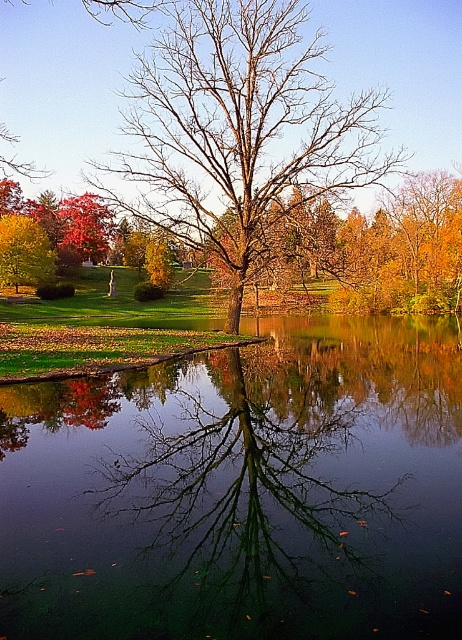
Question: Which point is farther to the camera?

Choices:
 (A) green reflective water at center
 (B) yellow-green leaves at left
 (C) bare wood tree at center

Answer: (B)

Question: Among these points, which one is nearest to the camera?

Choices:
 (A) (225, 72)
 (B) (133, 582)

Answer: (B)

Question: Is green reflective water at center positioned in front of yellow-green leaves at left?

Choices:
 (A) no
 (B) yes

Answer: (B)

Question: Is green reflective water at center positioned before yellow-green leaves at left?

Choices:
 (A) no
 (B) yes

Answer: (B)

Question: Is green reflective water at center positioned at the back of yellow-green leaves at left?

Choices:
 (A) yes
 (B) no

Answer: (B)

Question: Considering the real-world distances, which object is farthest from the bare wood tree at center?

Choices:
 (A) yellow-green leaves at left
 (B) green reflective water at center

Answer: (A)